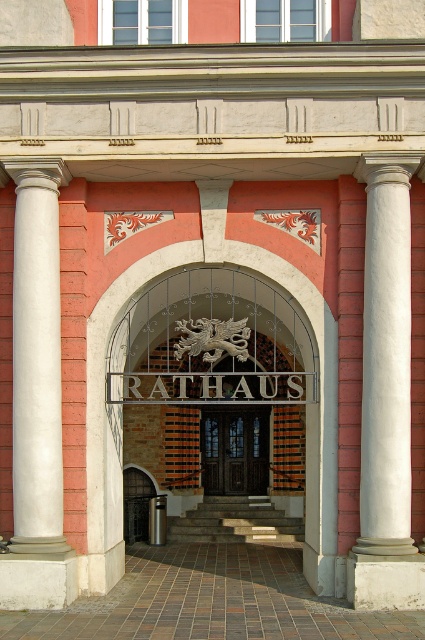
Based on the photo, you are standing at the entrance of the Rathaus building and want to take a photo of the white marble column at left. If your camera has a maximum focus range of 13 meters, will you need to move closer to capture it clearly?

The white marble column at left is 13.57 meters from the viewer. Since your camera can only focus up to 13 meters, you need to move closer to ensure the white marble column at left is within the focus range.

You are standing at the entrance of the Rathaus building and want to locate the white marble column at left. Can you tell me its exact coordinates?

The white marble column at left is located at coordinates point (36, 358).